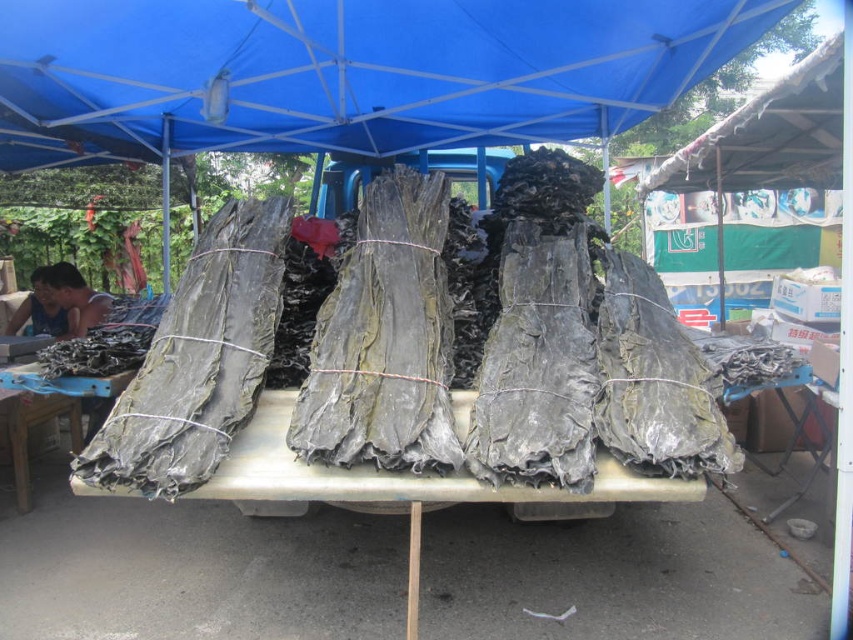
Is point (299, 472) closer to viewer compared to point (96, 314)?

That is True.

Identify the location of green leafy bundles at center. (402, 483).

Between blue fabric canopy at upper center and green leafy bundles at center, which one is positioned higher?

blue fabric canopy at upper center

Is blue fabric canopy at upper center wider than green leafy bundles at center?

Indeed, blue fabric canopy at upper center has a greater width compared to green leafy bundles at center.

What do you see at coordinates (346, 72) in the screenshot? The height and width of the screenshot is (640, 853). I see `blue fabric canopy at upper center` at bounding box center [346, 72].

I want to click on blue fabric canopy at upper center, so click(346, 72).

Is point (67, 337) closer to viewer compared to point (10, 326)?

Yes, point (67, 337) is in front of point (10, 326).

Does blue fabric vendor at left appear over matte black fabric at left?

Actually, blue fabric vendor at left is below matte black fabric at left.

Measure the distance between point [80,330] and camera.

14.70 feet

The image size is (853, 640). In order to click on blue fabric vendor at left in this screenshot , I will do `click(76, 298)`.